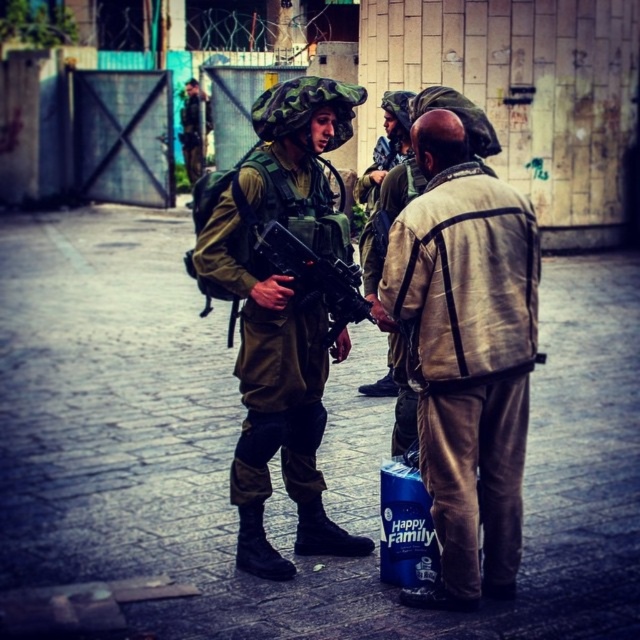
Which of these two, tan fabric jacket at center or matte black rifle at center, stands shorter?

matte black rifle at center is shorter.

Who is more distant from viewer, (444, 561) or (330, 285)?

The point (330, 285) is behind.

The image size is (640, 640). In order to click on tan fabric jacket at center in this screenshot , I will do `click(467, 355)`.

Is camouflage fabric uniform at center below camouflage uniform at upper left?

Indeed, camouflage fabric uniform at center is positioned under camouflage uniform at upper left.

In order to click on camouflage fabric uniform at center in this screenshot , I will do `click(280, 310)`.

Locate an element on the screen. camouflage fabric uniform at center is located at coordinates (280, 310).

What do you see at coordinates (467, 355) in the screenshot? I see `tan fabric jacket at center` at bounding box center [467, 355].

Does point (467, 268) lie behind point (244, 419)?

No, it is not.

Locate an element on the screen. tan fabric jacket at center is located at coordinates (467, 355).